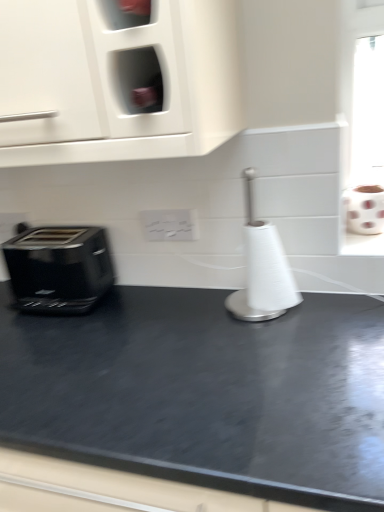
Question: Considering the relative sizes of white matte toilet paper at right and white glossy electric outlet at center in the image provided, is white matte toilet paper at right smaller than white glossy electric outlet at center?

Choices:
 (A) yes
 (B) no

Answer: (B)

Question: Is white matte toilet paper at right with white glossy electric outlet at center?

Choices:
 (A) no
 (B) yes

Answer: (A)

Question: Is white glossy electric outlet at center at the back of white matte toilet paper at right?

Choices:
 (A) no
 (B) yes

Answer: (A)

Question: Can you confirm if white matte toilet paper at right is taller than white glossy electric outlet at center?

Choices:
 (A) no
 (B) yes

Answer: (B)

Question: Is white matte toilet paper at right closer to camera compared to white glossy electric outlet at center?

Choices:
 (A) yes
 (B) no

Answer: (A)

Question: From a real-world perspective, is white matte toilet paper at right located beneath white glossy electric outlet at center?

Choices:
 (A) yes
 (B) no

Answer: (A)

Question: From a real-world perspective, is black glossy toaster at left on white glossy electric outlet at center?

Choices:
 (A) no
 (B) yes

Answer: (A)

Question: Can you confirm if black glossy toaster at left is thinner than white glossy electric outlet at center?

Choices:
 (A) yes
 (B) no

Answer: (B)

Question: Can you confirm if black glossy toaster at left is bigger than white glossy electric outlet at center?

Choices:
 (A) yes
 (B) no

Answer: (A)

Question: Is black glossy toaster at left facing towards white glossy electric outlet at center?

Choices:
 (A) no
 (B) yes

Answer: (A)

Question: Is black glossy toaster at left to the left of white glossy electric outlet at center from the viewer's perspective?

Choices:
 (A) no
 (B) yes

Answer: (B)

Question: Can you confirm if black glossy toaster at left is shorter than white glossy electric outlet at center?

Choices:
 (A) no
 (B) yes

Answer: (A)

Question: Can you confirm if white matte toilet paper at right is wider than white paper towel holder at center?

Choices:
 (A) yes
 (B) no

Answer: (B)